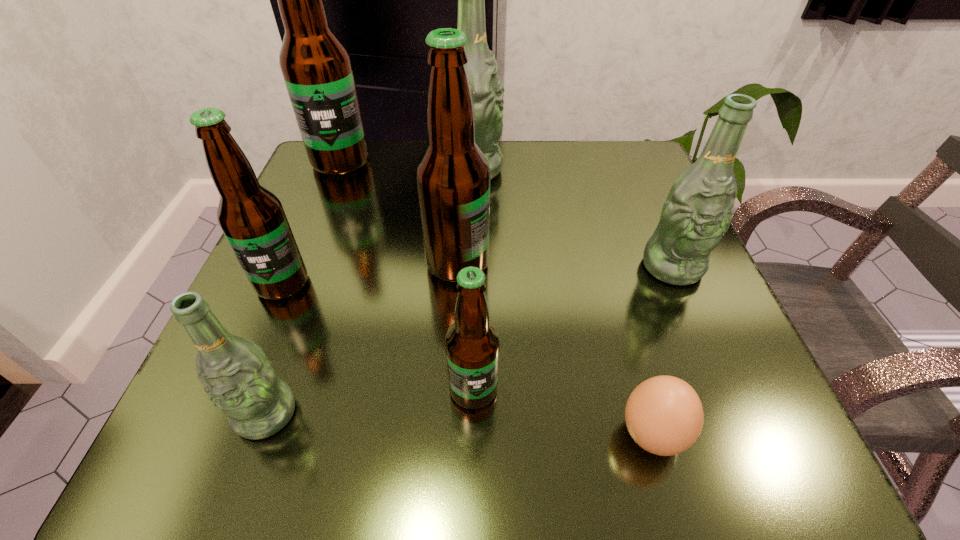
Locate an element on the screen. the tallest beer bottle is located at coordinates click(316, 66).

At what (x,y) coordinates should I click in order to perform the action: click on the farthest brown beer bottle. Please return your answer as a coordinate pair (x, y). Looking at the image, I should click on (316, 66).

In order to click on the farthest green beer bottle in this screenshot , I will do `click(486, 87)`.

Find the location of a particular element. The height and width of the screenshot is (540, 960). the biggest green beer bottle is located at coordinates [x=486, y=87].

Where is `the second biggest brown beer bottle`? the second biggest brown beer bottle is located at coordinates (452, 175).

Find the location of a particular element. The height and width of the screenshot is (540, 960). the second biggest green beer bottle is located at coordinates (697, 212).

The image size is (960, 540). Find the location of `the rightmost green beer bottle`. the rightmost green beer bottle is located at coordinates (697, 212).

At what (x,y) coordinates should I click in order to perform the action: click on the third biggest brown beer bottle. Please return your answer as a coordinate pair (x, y). The image size is (960, 540). Looking at the image, I should click on (252, 218).

Where is `the nearest brown beer bottle`? The width and height of the screenshot is (960, 540). the nearest brown beer bottle is located at coordinates (472, 343).

At what (x,y) coordinates should I click in order to perform the action: click on the leftmost green beer bottle. Please return your answer as a coordinate pair (x, y). Looking at the image, I should click on (239, 379).